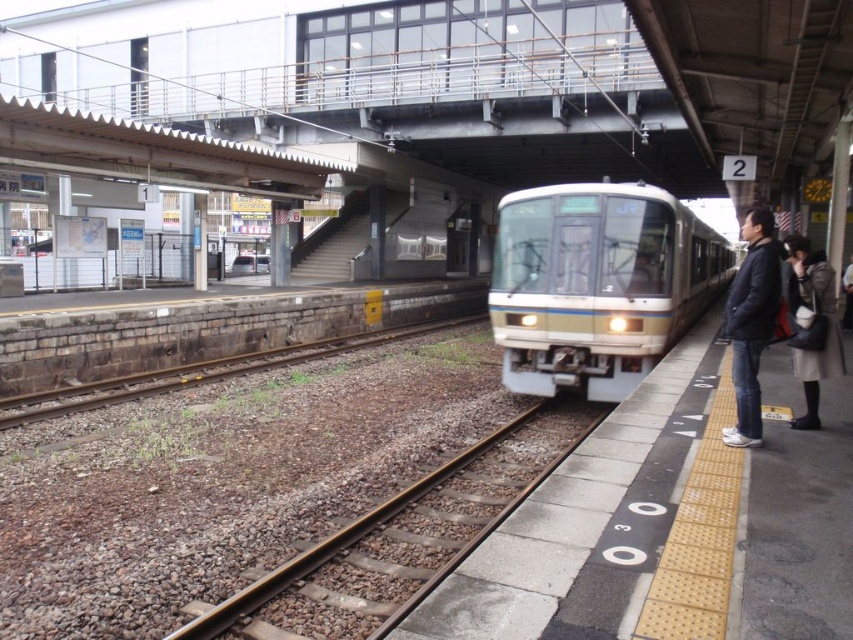
Who is more distant from viewer, (329, 576) or (735, 394)?

Point (735, 394)

This screenshot has width=853, height=640. Describe the element at coordinates (401, 540) in the screenshot. I see `brown gravel train track at center` at that location.

Identify the location of brown gravel train track at center. Image resolution: width=853 pixels, height=640 pixels. (401, 540).

Can you confirm if brown gravel train track at center is wider than matte gray coat at right?

No.

Is point (509, 490) more distant than point (828, 282)?

Yes.

Is point (305, 605) closer to camera compared to point (793, 428)?

Yes.

This screenshot has height=640, width=853. In order to click on brown gravel train track at center in this screenshot , I will do `click(401, 540)`.

Is matte white train at center shorter than brown gravel train track at center?

No, matte white train at center is not shorter than brown gravel train track at center.

Which is behind, point (624, 216) or point (286, 621)?

The point (624, 216) is behind.

Which is in front, point (511, 202) or point (347, 618)?

Point (347, 618)

The image size is (853, 640). Identify the location of matte white train at center. (596, 284).